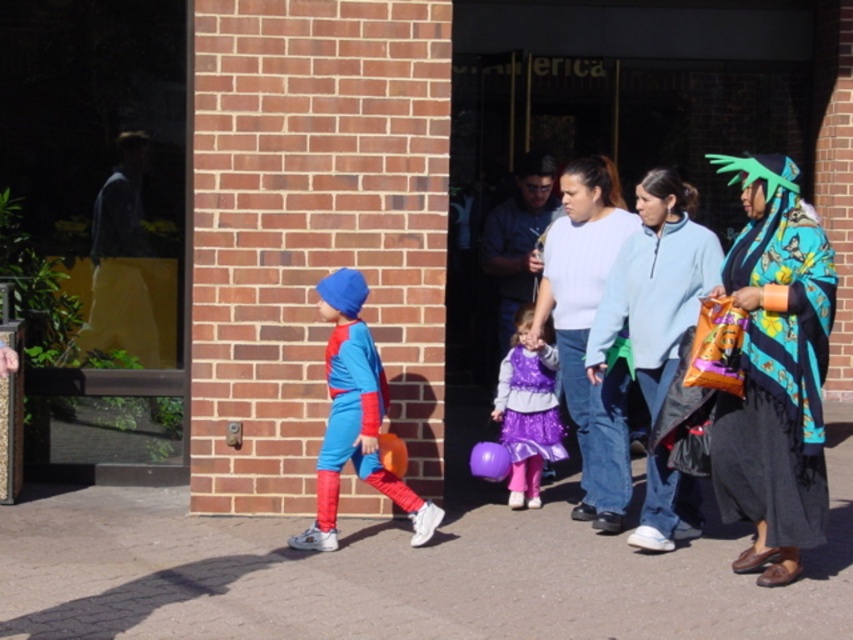
What is located at the coordinates point [761,372]?

The multicolored fabric scarf at center is located at point [761,372].